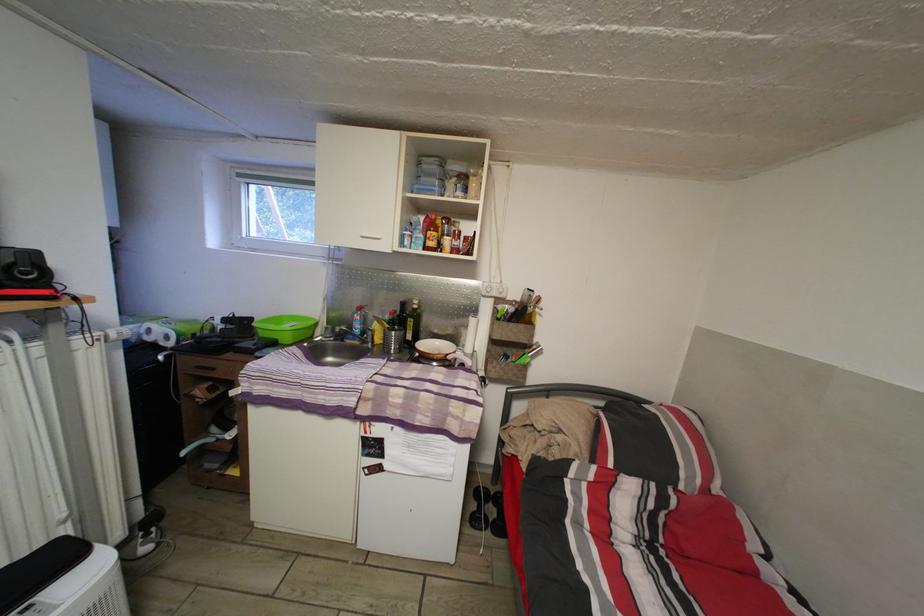
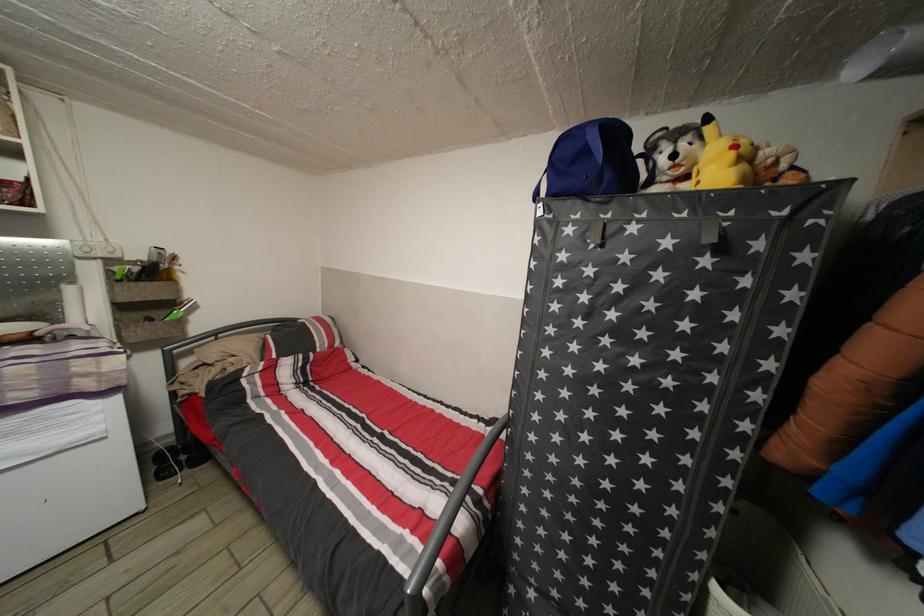
Locate, in the second image, the point that corresponds to point (528, 333) in the first image.

(164, 291)